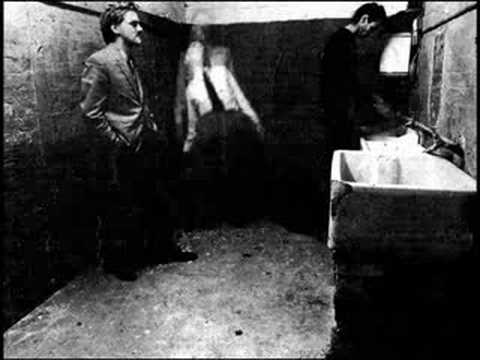
This screenshot has height=360, width=480. What are the coordinates of `window` in the screenshot? It's located at (395, 58).